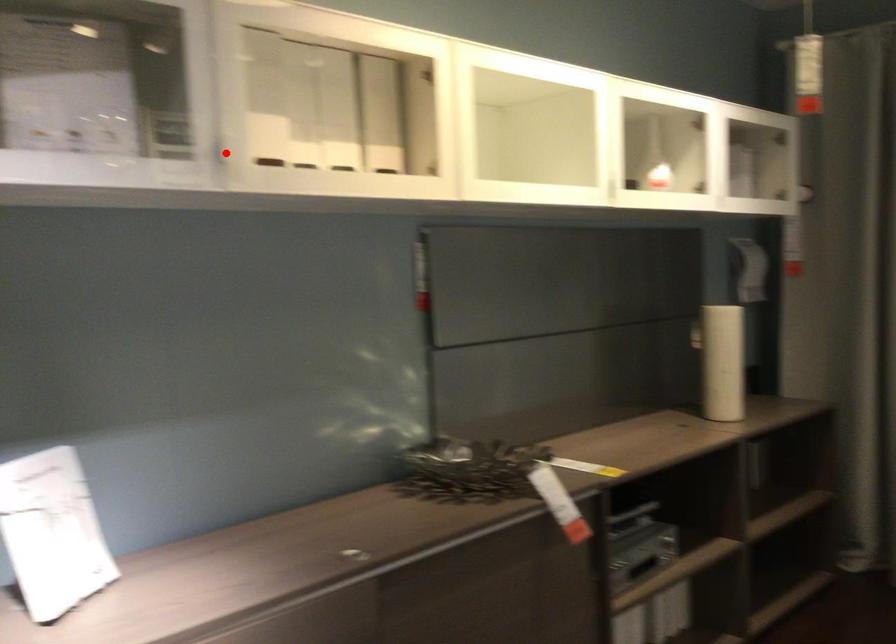
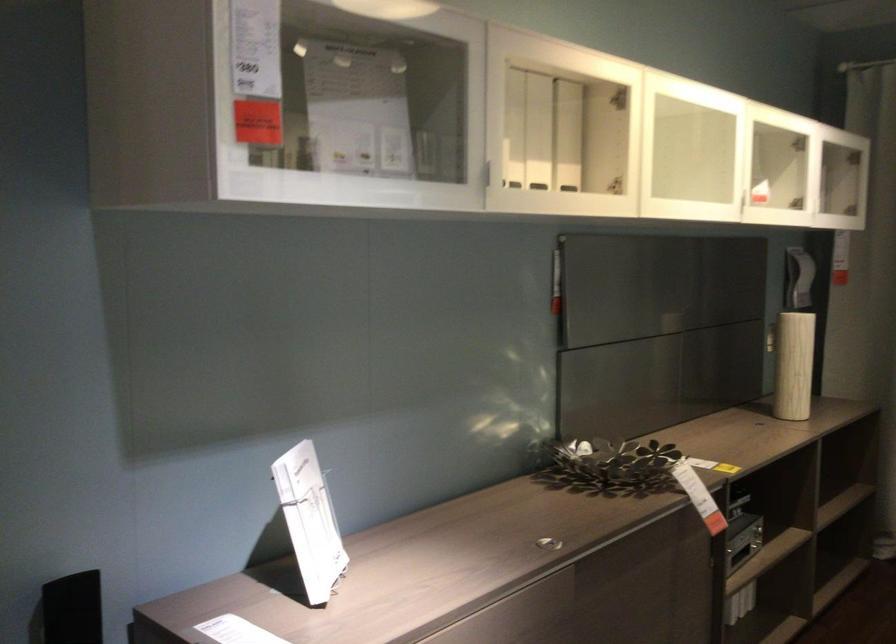
Question: I am providing you with two images of the same scene from different viewpoints. A red point is marked on the first image. Can you still see the location of the red point in image 2?

Choices:
 (A) Yes
 (B) No

Answer: (A)